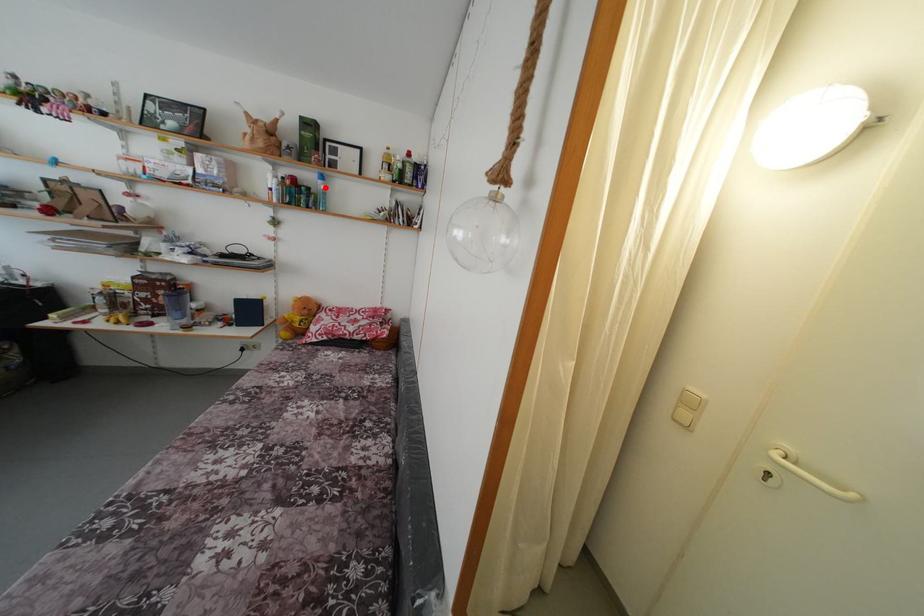
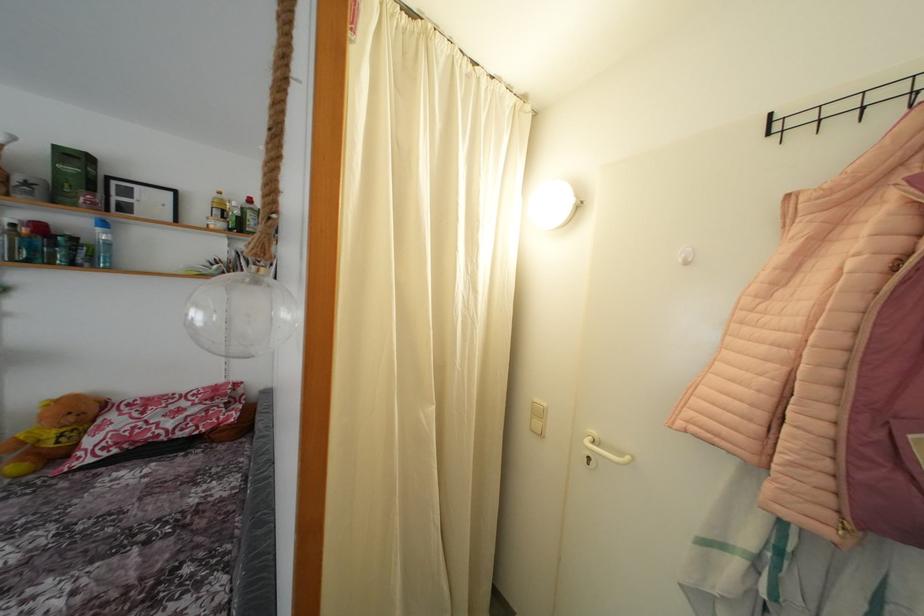
Where in the second image is the point corresponding to the highlighted location from the first image?

(104, 236)